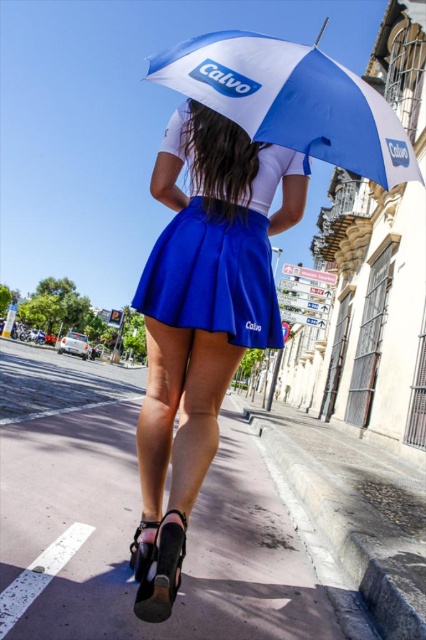
Question: Which is nearer to the blue satin skirt at center?

Choices:
 (A) blue pleated skirt at center
 (B) white/blue fabric umbrella at upper center

Answer: (A)

Question: Which object is positioned farthest from the blue pleated skirt at center?

Choices:
 (A) white/blue fabric umbrella at upper center
 (B) blue satin skirt at center

Answer: (A)

Question: In this image, where is blue pleated skirt at center located relative to blue satin skirt at center?

Choices:
 (A) right
 (B) left

Answer: (B)

Question: Can you confirm if blue pleated skirt at center is smaller than blue satin skirt at center?

Choices:
 (A) no
 (B) yes

Answer: (A)

Question: Which point is farther from the camera taking this photo?

Choices:
 (A) (181, 81)
 (B) (184, 212)

Answer: (B)

Question: Is blue pleated skirt at center below white/blue fabric umbrella at upper center?

Choices:
 (A) no
 (B) yes

Answer: (B)